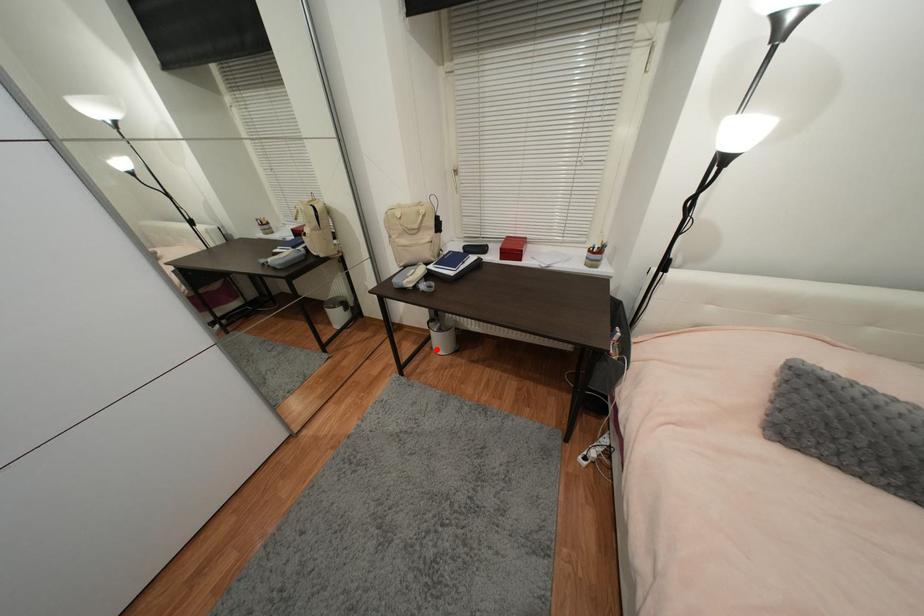
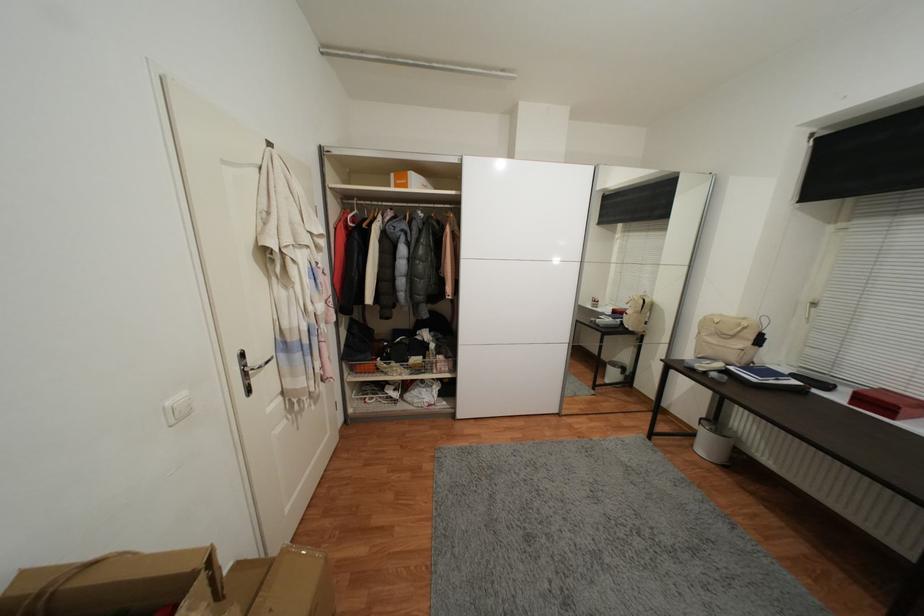
Question: I am providing you with two images of the same scene from different viewpoints. A red point is shown in image1. For the corresponding object point in image2, is it positioned nearer or farther from the camera?

Choices:
 (A) Nearer
 (B) Farther

Answer: (A)